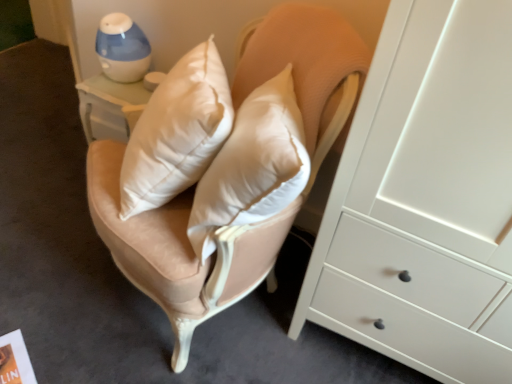
The width and height of the screenshot is (512, 384). I want to click on blue plastic humidifier at upper left, so click(x=122, y=48).

What do you see at coordinates (122, 48) in the screenshot? This screenshot has width=512, height=384. I see `blue plastic humidifier at upper left` at bounding box center [122, 48].

Image resolution: width=512 pixels, height=384 pixels. Describe the element at coordinates (193, 188) in the screenshot. I see `satin beige swivel chair at center` at that location.

Identify the location of satin beige swivel chair at center. The width and height of the screenshot is (512, 384). (193, 188).

This screenshot has height=384, width=512. I want to click on blue plastic humidifier at upper left, so click(122, 48).

Which object is positioned more to the right, blue plastic humidifier at upper left or satin beige swivel chair at center?

satin beige swivel chair at center.

Considering the positions of objects blue plastic humidifier at upper left and satin beige swivel chair at center in the image provided, who is in front, blue plastic humidifier at upper left or satin beige swivel chair at center?

Positioned in front is satin beige swivel chair at center.

Considering the points (120, 62) and (322, 15), which point is behind, point (120, 62) or point (322, 15)?

The point (120, 62) is farther from the camera.

From the image's perspective, between blue plastic humidifier at upper left and satin beige swivel chair at center, which one is located above?

blue plastic humidifier at upper left, from the image's perspective.

From a real-world perspective, which is physically below, blue plastic humidifier at upper left or satin beige swivel chair at center?

satin beige swivel chair at center.

Between blue plastic humidifier at upper left and satin beige swivel chair at center, which one has larger width?

satin beige swivel chair at center.

Consider the image. Considering the relative sizes of blue plastic humidifier at upper left and satin beige swivel chair at center in the image provided, is blue plastic humidifier at upper left taller than satin beige swivel chair at center?

No.

Is blue plastic humidifier at upper left smaller than satin beige swivel chair at center?

Correct, blue plastic humidifier at upper left occupies less space than satin beige swivel chair at center.

Does blue plastic humidifier at upper left contain satin beige swivel chair at center?

No.

Is blue plastic humidifier at upper left with satin beige swivel chair at center?

No, blue plastic humidifier at upper left is not with satin beige swivel chair at center.

Could you tell me if blue plastic humidifier at upper left is facing satin beige swivel chair at center?

No, blue plastic humidifier at upper left is not facing towards satin beige swivel chair at center.

This screenshot has height=384, width=512. What are the coordinates of `swivel chair located on the right of blue plastic humidifier at upper left` in the screenshot? It's located at (193, 188).

Which object is positioned more to the left, satin beige swivel chair at center or blue plastic humidifier at upper left?

blue plastic humidifier at upper left.

Consider the image. Which object is closer to the camera, satin beige swivel chair at center or blue plastic humidifier at upper left?

satin beige swivel chair at center is in front.

Is point (304, 92) more distant than point (106, 49)?

No, (304, 92) is in front of (106, 49).

From the image's perspective, does satin beige swivel chair at center appear higher than blue plastic humidifier at upper left?

Actually, satin beige swivel chair at center appears below blue plastic humidifier at upper left in the image.

From a real-world perspective, between satin beige swivel chair at center and blue plastic humidifier at upper left, who is vertically higher?

blue plastic humidifier at upper left.

Which of these two, satin beige swivel chair at center or blue plastic humidifier at upper left, is thinner?

blue plastic humidifier at upper left is thinner.

Is satin beige swivel chair at center shorter than blue plastic humidifier at upper left?

No.

Does satin beige swivel chair at center have a smaller size compared to blue plastic humidifier at upper left?

Actually, satin beige swivel chair at center might be larger than blue plastic humidifier at upper left.

Is satin beige swivel chair at center situated inside blue plastic humidifier at upper left or outside?

satin beige swivel chair at center is located beyond the bounds of blue plastic humidifier at upper left.

Is there a large distance between satin beige swivel chair at center and blue plastic humidifier at upper left?

Actually, satin beige swivel chair at center and blue plastic humidifier at upper left are a little close together.

From the picture: Does satin beige swivel chair at center turn towards blue plastic humidifier at upper left?

No.

How different are the orientations of satin beige swivel chair at center and blue plastic humidifier at upper left in degrees?

The angle between the facing direction of satin beige swivel chair at center and the facing direction of blue plastic humidifier at upper left is 27.9 degrees.

Locate an element on the screen. The image size is (512, 384). table lamp to the left of satin beige swivel chair at center is located at coordinates (122, 48).

Where is `swivel chair in front of the blue plastic humidifier at upper left`? Image resolution: width=512 pixels, height=384 pixels. swivel chair in front of the blue plastic humidifier at upper left is located at coordinates (193, 188).

You are a GUI agent. You are given a task and a screenshot of the screen. Output one action in this format:
    pyautogui.click(x=<x>, y=<y>)
    Task: Click on the table lamp behind the satin beige swivel chair at center
    
    Given the screenshot: What is the action you would take?
    pyautogui.click(x=122, y=48)